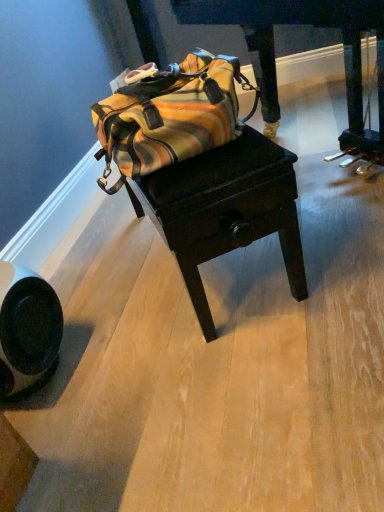
Question: Choose the correct answer: Is striped canvas duffel bag at center inside wooden table at center or outside it?

Choices:
 (A) inside
 (B) outside

Answer: (B)

Question: Is point (160, 117) positioned closer to the camera than point (235, 197)?

Choices:
 (A) farther
 (B) closer

Answer: (B)

Question: Estimate the real-world distances between objects in this image. Which object is farther from the wooden table at center?

Choices:
 (A) striped canvas duffel bag at center
 (B) dark wood drawer at center

Answer: (B)

Question: Estimate the real-world distances between objects in this image. Which object is farther from the wooden table at center?

Choices:
 (A) dark wood drawer at center
 (B) striped canvas duffel bag at center

Answer: (A)